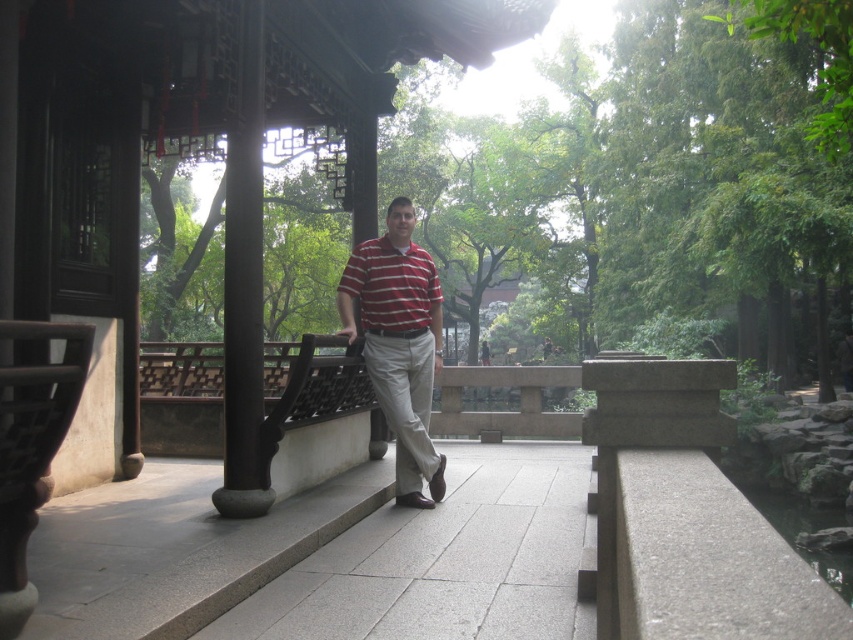
Locate an element on the screen. The height and width of the screenshot is (640, 853). wooden lattice gazebo at center is located at coordinates (194, 147).

Which is more to the right, wooden lattice gazebo at center or striped cotton polo shirt at center?

striped cotton polo shirt at center

Who is more forward, (123,67) or (416,257)?

Positioned in front is point (416,257).

The image size is (853, 640). I want to click on wooden lattice gazebo at center, so click(194, 147).

Between point (592, 625) and point (383, 260), which one is positioned behind?

The point (383, 260) is behind.

Is gray stone path at center below matte striped shirt at center?

Indeed, gray stone path at center is positioned under matte striped shirt at center.

Which is behind, point (560, 573) or point (425, 474)?

The point (425, 474) is behind.

Identify the location of gray stone path at center. This screenshot has width=853, height=640. (445, 561).

Is wooden lattice gazebo at center bigger than gray stone path at center?

Indeed, wooden lattice gazebo at center has a larger size compared to gray stone path at center.

Does wooden lattice gazebo at center appear on the right side of gray stone path at center?

No, wooden lattice gazebo at center is not to the right of gray stone path at center.

Image resolution: width=853 pixels, height=640 pixels. Describe the element at coordinates (194, 147) in the screenshot. I see `wooden lattice gazebo at center` at that location.

Where is `wooden lattice gazebo at center`? The height and width of the screenshot is (640, 853). wooden lattice gazebo at center is located at coordinates (194, 147).